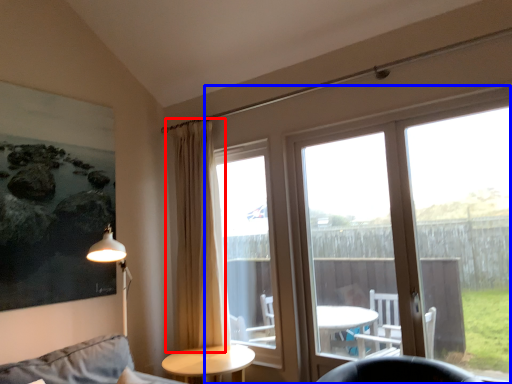
Question: Which object is further to the camera taking this photo, curtain (highlighted by a red box) or window (highlighted by a blue box)?

Choices:
 (A) curtain
 (B) window

Answer: (A)